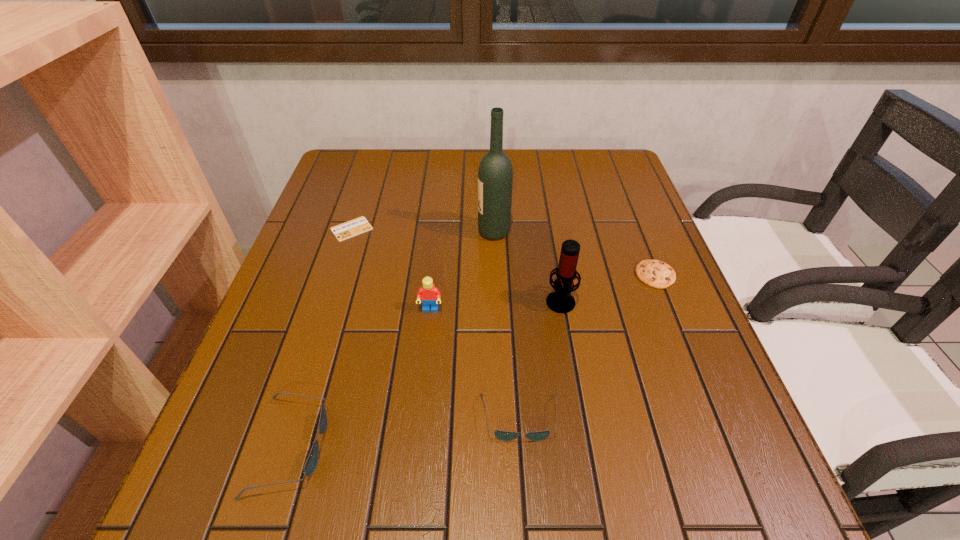
You are a GUI agent. You are given a task and a screenshot of the screen. Output one action in this format:
    pyautogui.click(x=<x>, y=<y>)
    Task: Click on the vacant area that lies between the shorter sunglasses and the sixth object from left to right
    
    Given the screenshot: What is the action you would take?
    pyautogui.click(x=540, y=359)

At what (x,y) coordinates should I click in order to perform the action: click on object that stands as the second closest to the rightmost object. Please return your answer as a coordinate pair (x, y). Image resolution: width=960 pixels, height=540 pixels. Looking at the image, I should click on (495, 174).

At what (x,y) coordinates should I click in order to perform the action: click on object that is the closest one to the second tallest object. Please return your answer as a coordinate pair (x, y). The image size is (960, 540). Looking at the image, I should click on (657, 274).

You are a GUI agent. You are given a task and a screenshot of the screen. Output one action in this format:
    pyautogui.click(x=<x>, y=<y>)
    Task: Click on the free spot that satisfies the following two spatial constraints: 1. on the labeled side of the wine bottle; 2. on the left side of the microphone
    The width and height of the screenshot is (960, 540).
    Given the screenshot: What is the action you would take?
    pyautogui.click(x=496, y=300)

Where is `vacant area that satisfies the following two spatial constraints: 1. on the labeled side of the tallest object; 2. on the back side of the cookie`? Image resolution: width=960 pixels, height=540 pixels. vacant area that satisfies the following two spatial constraints: 1. on the labeled side of the tallest object; 2. on the back side of the cookie is located at coordinates (495, 275).

I want to click on vacant point that satisfies the following two spatial constraints: 1. on the labeled side of the wine bottle; 2. on the right side of the second shortest object, so click(495, 275).